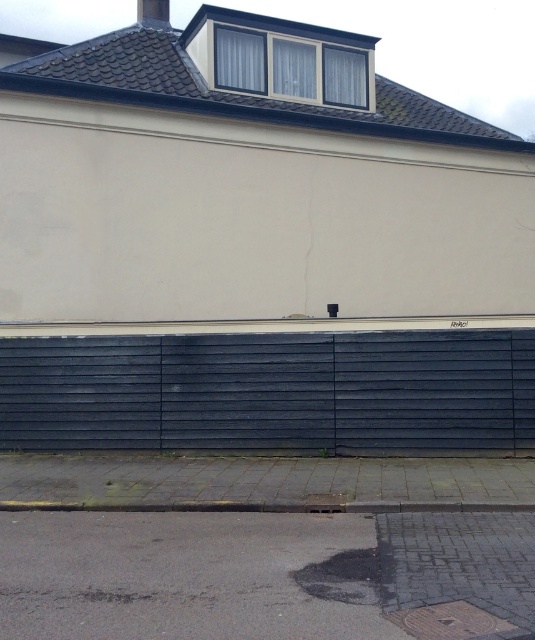
You are standing in front of the building and want to walk to the gray concrete curb at lower center. Which direction should you move relative to the dark gray wood fence at lower center?

You should move to the right of the dark gray wood fence at lower center to reach the gray concrete curb at lower center because the dark gray wood fence at lower center is positioned to the left of the gray concrete curb at lower center.

You are a delivery person with a cart that is 6 feet wide. You need to move your cart from the dark asphalt pavement at lower center to the gray concrete curb at lower center. Is there enough space between them for your cart to pass through?

The dark asphalt pavement at lower center and gray concrete curb at lower center are 7.25 feet apart. Since the cart is 6 feet wide, there is enough space for it to pass through between them.